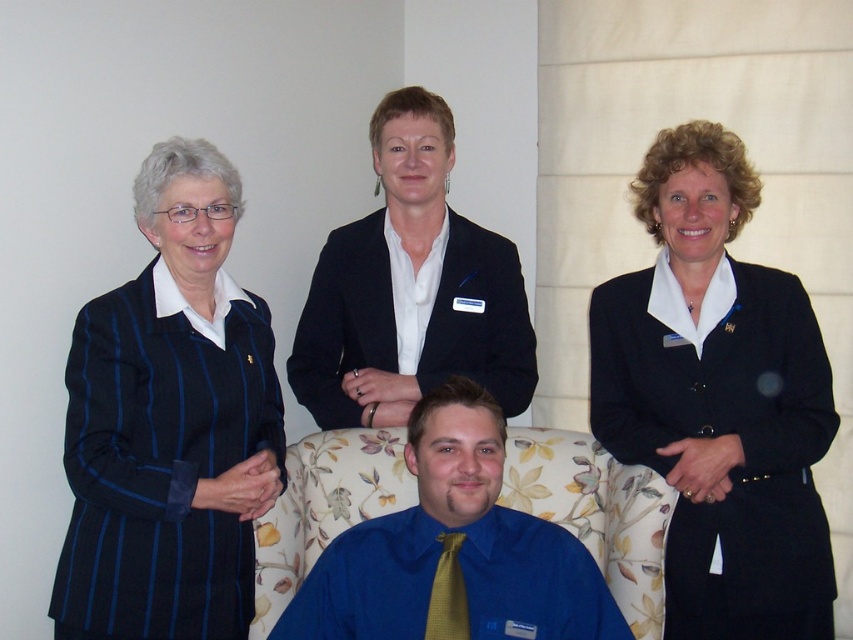
Is black matte blazer at right above yellow textured tie at center?

Yes.

Is the position of black matte blazer at right less distant than that of yellow textured tie at center?

No, it is behind yellow textured tie at center.

The height and width of the screenshot is (640, 853). I want to click on black matte blazer at right, so click(718, 400).

Who is lower down, blue satin shirt at center or yellow textured tie at center?

yellow textured tie at center is lower down.

Does blue satin shirt at center have a lesser height compared to yellow textured tie at center?

No, blue satin shirt at center is not shorter than yellow textured tie at center.

Who is more forward, [326,616] or [431,598]?

Point [431,598]

This screenshot has height=640, width=853. I want to click on blue satin shirt at center, so click(x=454, y=550).

Between black matte blazer at right and black matte blazer at center, which one has more height?

Standing taller between the two is black matte blazer at right.

Consider the image. Does black matte blazer at right appear over black matte blazer at center?

Incorrect, black matte blazer at right is not positioned above black matte blazer at center.

The width and height of the screenshot is (853, 640). Identify the location of black matte blazer at right. pos(718,400).

Identify the location of black matte blazer at right. (718, 400).